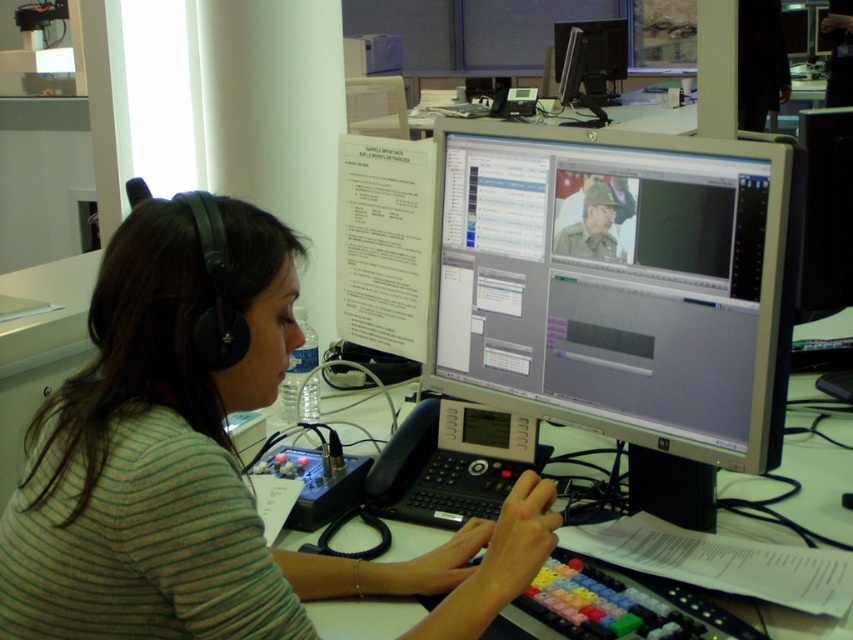
Question: Which point appears farthest from the camera in this image?

Choices:
 (A) (569, 44)
 (B) (498, 164)

Answer: (A)

Question: Which point is farther to the camera?

Choices:
 (A) (341, 621)
 (B) (706, 291)
 (C) (141, 492)

Answer: (B)

Question: Where is matte gray monitor at center located in relation to matte black monitor at upper center in the image?

Choices:
 (A) below
 (B) above

Answer: (A)

Question: From the image, what is the correct spatial relationship of matte gray monitor at center in relation to matte black monitor at upper center?

Choices:
 (A) above
 (B) below

Answer: (B)

Question: Which point is closer to the camera taking this photo?

Choices:
 (A) (840, 528)
 (B) (579, 52)
 (C) (764, 369)

Answer: (C)

Question: Can you confirm if matte gray monitor at center is positioned to the left of matte black monitor at upper center?

Choices:
 (A) no
 (B) yes

Answer: (B)